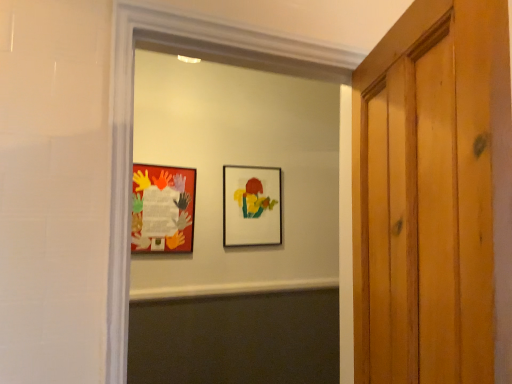
Question: From the image's perspective, would you say matte paper collage at center is shown under matte paper collage at left, the 2th picture frame when ordered from right to left?

Choices:
 (A) yes
 (B) no

Answer: (A)

Question: Is matte paper collage at center in contact with matte paper collage at left, the 2th picture frame when ordered from right to left?

Choices:
 (A) no
 (B) yes

Answer: (A)

Question: From a real-world perspective, is matte paper collage at center positioned under matte paper collage at left, marked as the second picture frame in a back-to-front arrangement, based on gravity?

Choices:
 (A) no
 (B) yes

Answer: (B)

Question: Is matte paper collage at center smaller than matte paper collage at left, the 2th picture frame when ordered from right to left?

Choices:
 (A) yes
 (B) no

Answer: (B)

Question: Is the depth of matte paper collage at center less than that of matte paper collage at left, which appears as the 1th picture frame when viewed from the front?

Choices:
 (A) no
 (B) yes

Answer: (B)

Question: Based on their positions, is matte paper collage at left, which appears as the 1th picture frame when viewed from the front, located to the left or right of matte paper collage at center?

Choices:
 (A) right
 (B) left

Answer: (B)

Question: Is matte paper collage at left, which appears as the 1th picture frame when viewed from the front, inside or outside of matte paper collage at center?

Choices:
 (A) outside
 (B) inside

Answer: (A)

Question: From their relative heights in the image, would you say matte paper collage at left, which is counted as the first picture frame, starting from the left, is taller or shorter than matte paper collage at center?

Choices:
 (A) short
 (B) tall

Answer: (A)

Question: Considering the positions of matte paper collage at left, which is counted as the first picture frame, starting from the left, and matte paper collage at center in the image, is matte paper collage at left, which is counted as the first picture frame, starting from the left, bigger or smaller than matte paper collage at center?

Choices:
 (A) small
 (B) big

Answer: (A)

Question: Based on their positions, is matte paper collage at center located to the left or right of matte plastic picture frame at center, the 1th picture frame in the back-to-front sequence?

Choices:
 (A) right
 (B) left

Answer: (A)

Question: Is point click(x=265, y=271) positioned closer to the camera than point click(x=233, y=203)?

Choices:
 (A) closer
 (B) farther

Answer: (B)

Question: From a real-world perspective, is matte paper collage at center physically located above or below matte plastic picture frame at center, marked as the 2th picture frame in a left-to-right arrangement?

Choices:
 (A) below
 (B) above

Answer: (A)

Question: Is matte paper collage at center inside the boundaries of matte plastic picture frame at center, which is the first picture frame in right-to-left order, or outside?

Choices:
 (A) outside
 (B) inside

Answer: (A)

Question: Considering their positions, is matte paper collage at left, the 2th picture frame when ordered from right to left, located in front of or behind matte plastic picture frame at center, which is the first picture frame in right-to-left order?

Choices:
 (A) behind
 (B) front

Answer: (B)

Question: Is matte paper collage at left, marked as the second picture frame in a back-to-front arrangement, spatially inside matte plastic picture frame at center, which is the first picture frame in right-to-left order, or outside of it?

Choices:
 (A) outside
 (B) inside

Answer: (A)